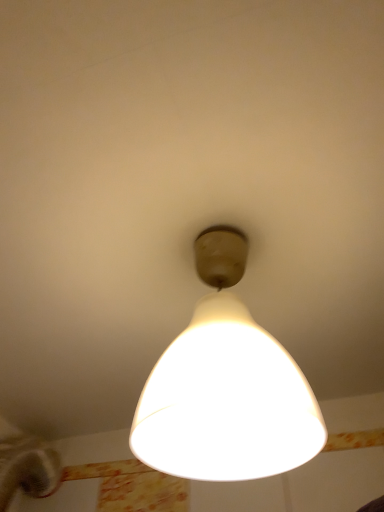
Question: Should I look upward or downward to see matte white lampshade at center?

Choices:
 (A) up
 (B) down

Answer: (B)